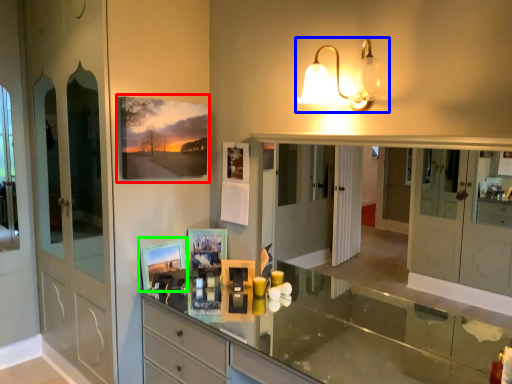
Question: Estimate the real-world distances between objects in this image. Which object is farther from picture frame (highlighted by a red box), lamp (highlighted by a blue box) or picture frame (highlighted by a green box)?

Choices:
 (A) lamp
 (B) picture frame

Answer: (A)